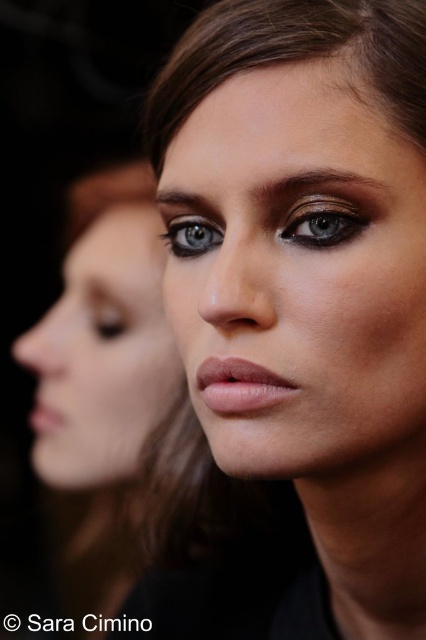
You are a makeup artist preparing for a photoshoot. You have two products to place on a makeup palette for a client. The matte green eye at center and the matte pink lipstick at lower left. Which product takes up more space on the palette?

The matte pink lipstick at lower left takes up more space on the palette because the matte green eye at center occupies less space than the matte pink lipstick at lower left according to the description.

You are taking a photo and want to focus on the person in the foreground. Which of the two points, point (423, 113) or point (374, 180), is closer to the camera?

Point (423, 113) is further to the camera than point (374, 180), so the point closer to the camera is point (374, 180).

You are a makeup artist preparing to apply eyeliner to both the brown smooth hair at upper center and the dark brown matte eyebrow at upper center. Considering their widths, which object would require a wider eyeliner application area?

The brown smooth hair at upper center has a greater width than the dark brown matte eyebrow at upper center, so the eyeliner application area would need to be wider for the brown smooth hair at upper center.